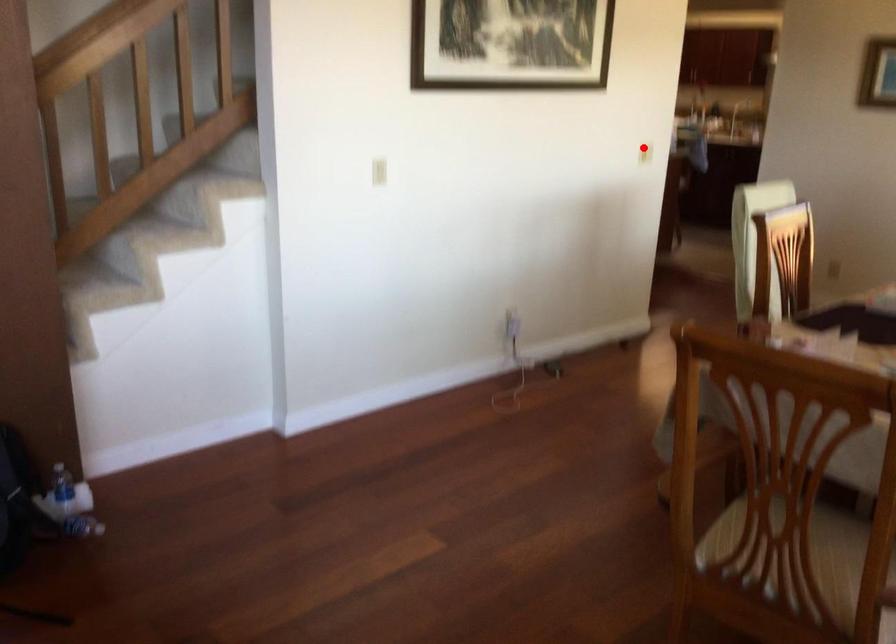
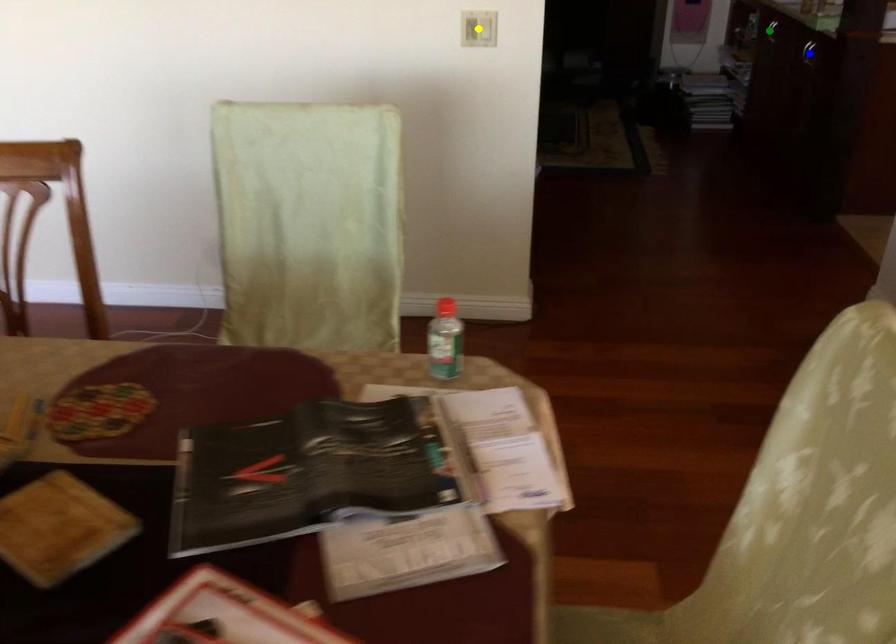
Question: I am providing you with two images of the same scene from different viewpoints. A red point is marked on the first image. You are given multiple points on the second image. Which mark in image 2 goes with the point in image 1?

Choices:
 (A) blue point
 (B) yellow point
 (C) green point

Answer: (B)